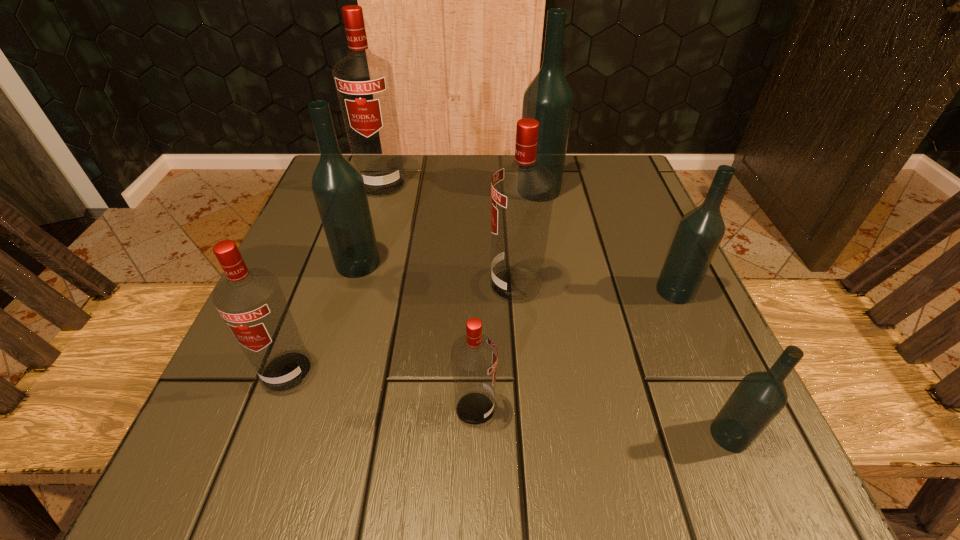
Select which red vodka is the fourth closest to the nearest black vodka. Please provide its 2D coordinates. Your answer should be formatted as a tuple, i.e. [(x, y)], where the tuple contains the x and y coordinates of a point satisfying the conditions above.

[(364, 83)]

Point out which black vodka is positioned as the third nearest to the second biggest black vodka. Please provide its 2D coordinates. Your answer should be formatted as a tuple, i.e. [(x, y)], where the tuple contains the x and y coordinates of a point satisfying the conditions above.

[(760, 396)]

Choose which black vodka is the third nearest neighbor to the farthest red vodka. Please provide its 2D coordinates. Your answer should be formatted as a tuple, i.e. [(x, y)], where the tuple contains the x and y coordinates of a point satisfying the conditions above.

[(699, 234)]

The height and width of the screenshot is (540, 960). Identify the location of blank area in the image that satisfies the following two spatial constraints: 1. on the front label of the second smallest black vodka; 2. on the right side of the third smallest red vodka. (516, 291).

You are a GUI agent. You are given a task and a screenshot of the screen. Output one action in this format:
    pyautogui.click(x=<x>, y=<y>)
    Task: Click on the vacant space that satisfies the following two spatial constraints: 1. on the front label of the third biggest black vodka; 2. on the left side of the third smallest red vodka
    Image resolution: width=960 pixels, height=540 pixels.
    Given the screenshot: What is the action you would take?
    [x=516, y=291]

In order to click on free spot that satisfies the following two spatial constraints: 1. on the front label of the third nearest red vodka; 2. on the left side of the nearest black vodka in this screenshot , I will do `click(528, 435)`.